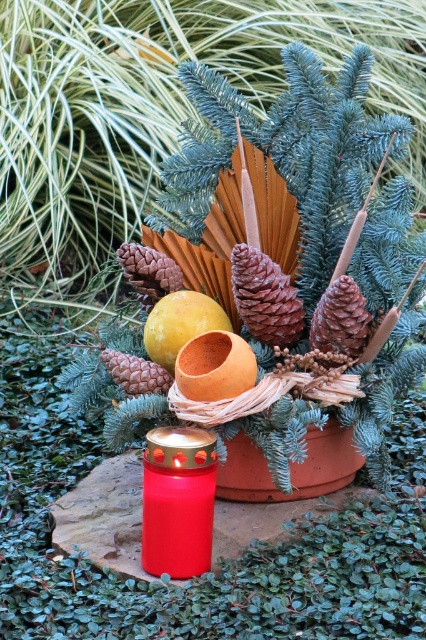
Question: Among these objects, which one is farthest from the camera?

Choices:
 (A) matte red candle at lower left
 (B) brown matte pine cone at center-left
 (C) orange matte bowl at center

Answer: (B)

Question: Which point is closer to the camera?

Choices:
 (A) orange matte bowl at center
 (B) yellow matte/orange fruit at center

Answer: (A)

Question: Does yellow matte/orange fruit at center lie behind brown matte pine cone at center-left?

Choices:
 (A) no
 (B) yes

Answer: (B)

Question: Which object is closer to the camera taking this photo?

Choices:
 (A) matte red candle at lower left
 (B) brown matte pine cone at center-left

Answer: (A)

Question: Can you confirm if orange matte bowl at center is smaller than brown matte pine cone at center-left?

Choices:
 (A) yes
 (B) no

Answer: (B)

Question: Can you confirm if yellow matte/orange fruit at center is bigger than brown matte pine cone at center-left?

Choices:
 (A) no
 (B) yes

Answer: (B)